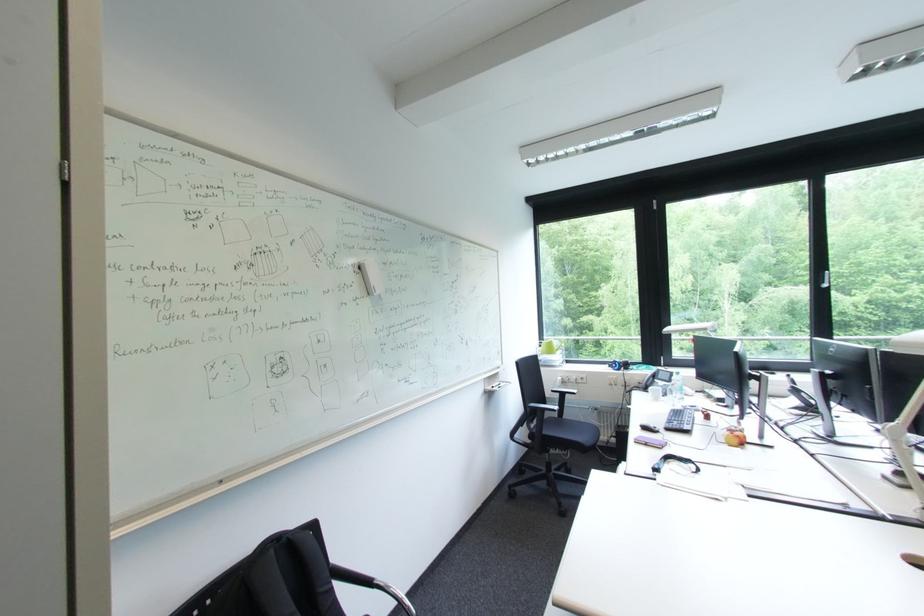
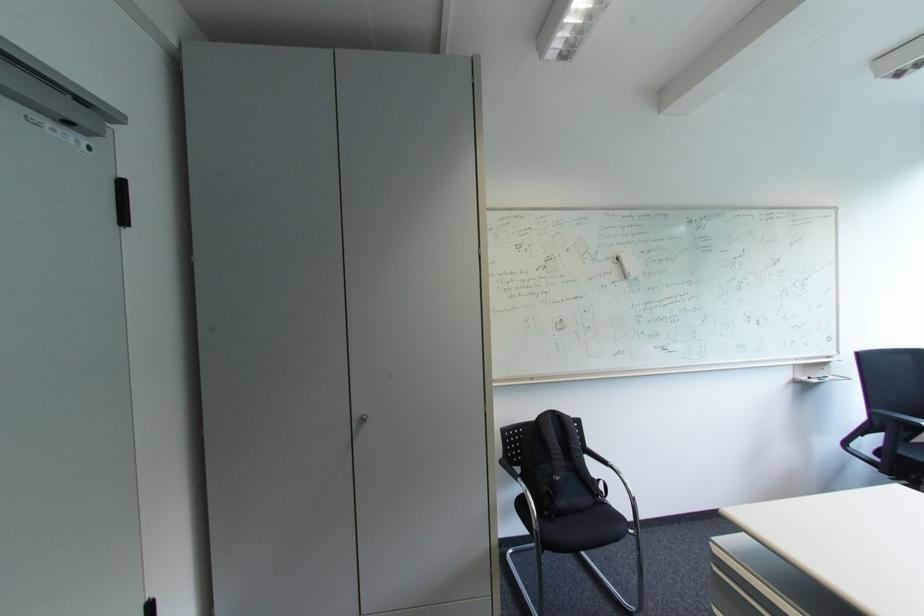
Question: Based on the continuous images, in which direction is the camera rotating? Reply with the corresponding letter.

Choices:
 (A) Left
 (B) Right
 (C) Up
 (D) Down

Answer: (A)